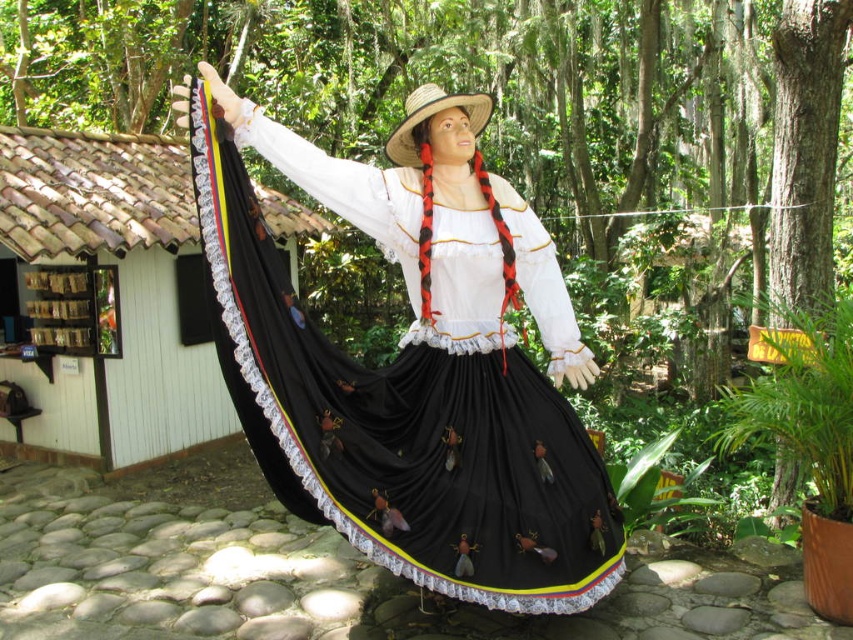
Question: Which of the following is the closest to the observer?

Choices:
 (A) (245, 314)
 (B) (418, 140)

Answer: (A)

Question: Which point appears farthest from the camera in this image?

Choices:
 (A) (425, 108)
 (B) (357, 406)

Answer: (A)

Question: Is black satin dress at center wider than straw hat at center?

Choices:
 (A) no
 (B) yes

Answer: (B)

Question: Can you confirm if black satin dress at center is thinner than straw hat at center?

Choices:
 (A) yes
 (B) no

Answer: (B)

Question: Does black satin dress at center appear over straw hat at center?

Choices:
 (A) yes
 (B) no

Answer: (B)